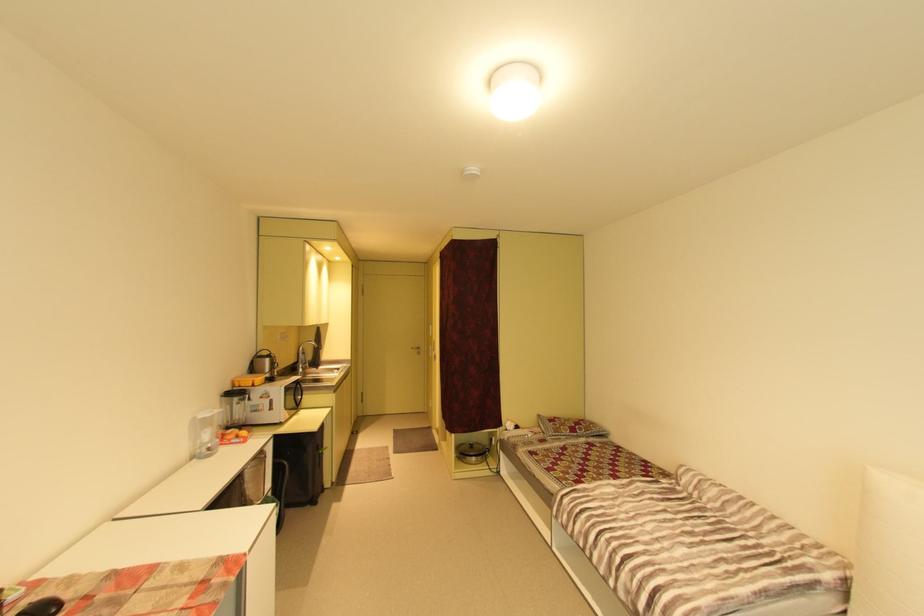
What are the coordinates of `white microwave handle` in the screenshot? It's located at (298, 392).